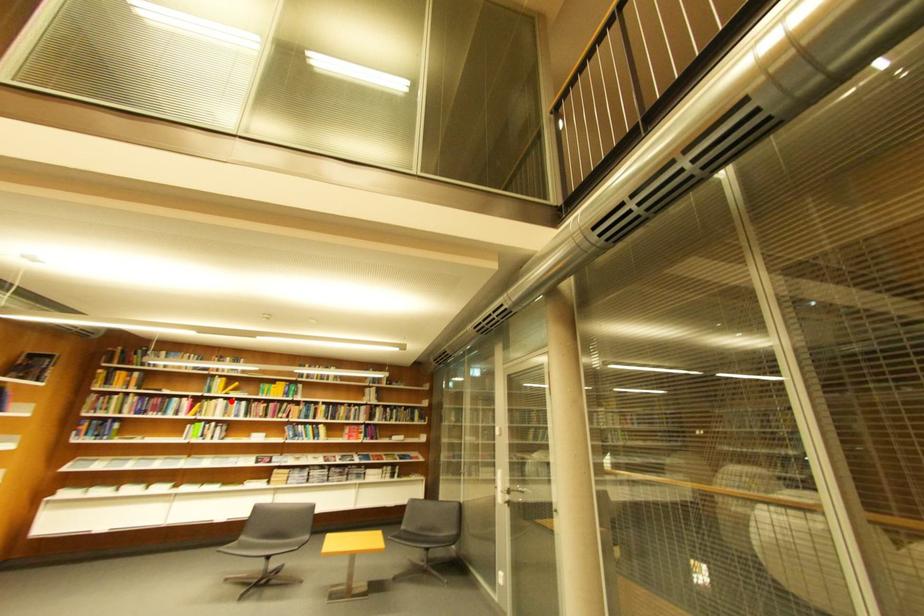
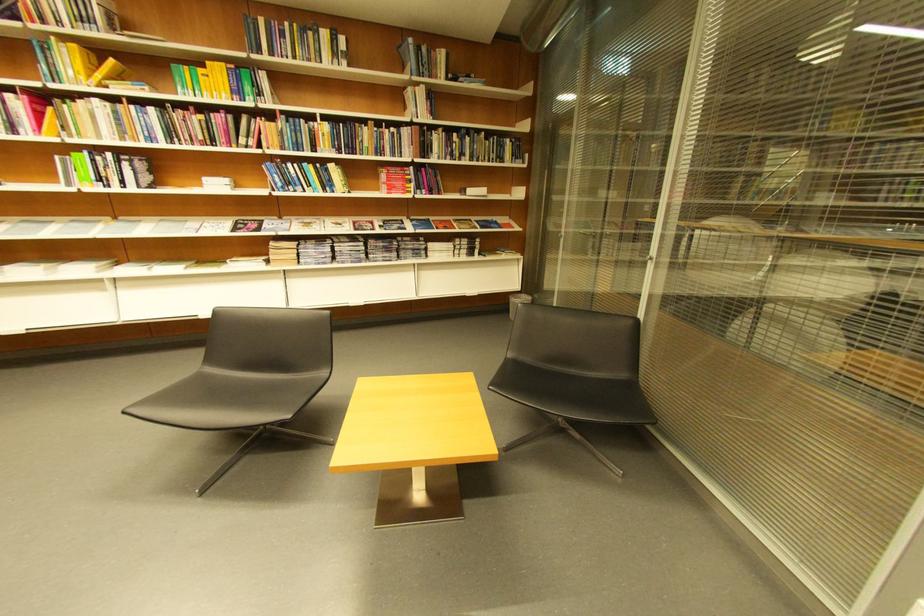
Locate, in the second image, the point that corresponds to the highlighted location in the first image.

(106, 102)